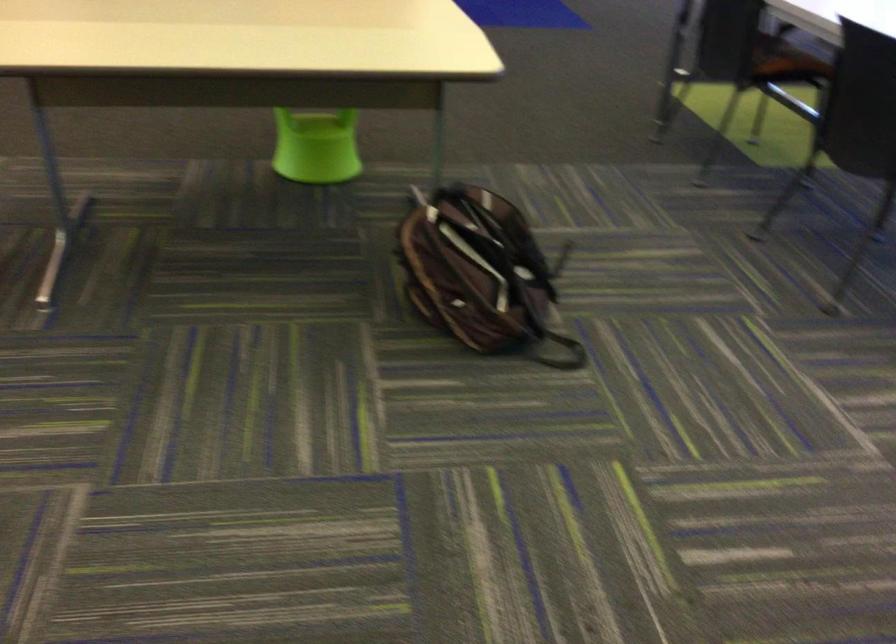
Find where to lift the black backpack strap. Please return your answer as a coordinate pair (x, y).

(552, 322)